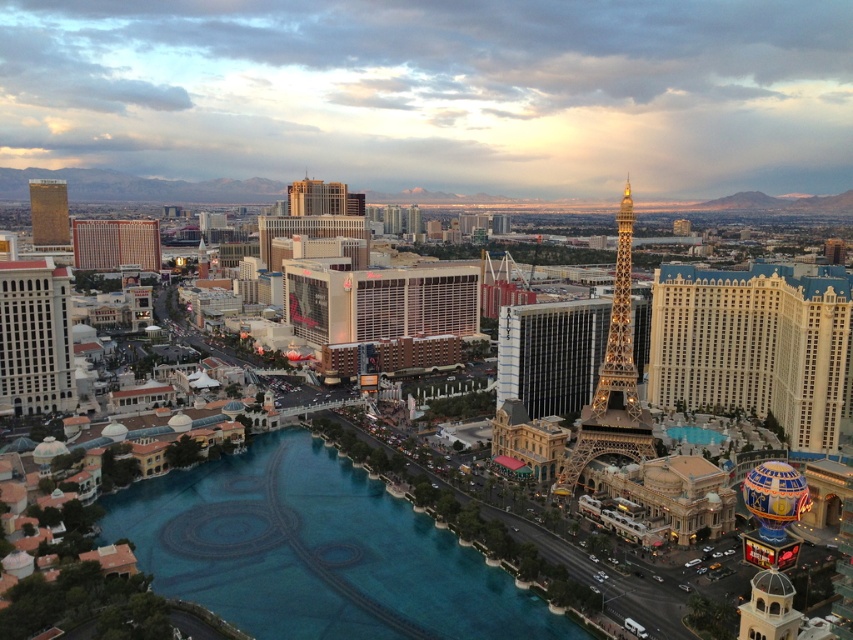
Which is more to the left, gold metallic eiffel tower at center-right or shiny gold metal eiffel tower at center right?

shiny gold metal eiffel tower at center right is more to the left.

Is point (706, 376) positioned after point (619, 365)?

Yes, point (706, 376) is behind point (619, 365).

Identify the location of gold metallic eiffel tower at center-right. (755, 346).

Which of these two, shiny gold metal eiffel tower at center right or gold metallic hotel at center-left, stands shorter?

With less height is gold metallic hotel at center-left.

Is shiny gold metal eiffel tower at center right taller than gold metallic hotel at center-left?

Correct, shiny gold metal eiffel tower at center right is much taller as gold metallic hotel at center-left.

The height and width of the screenshot is (640, 853). I want to click on shiny gold metal eiffel tower at center right, so click(x=613, y=380).

Is gold metallic eiffel tower at center-right smaller than gold reflective tower at upper left?

Indeed, gold metallic eiffel tower at center-right has a smaller size compared to gold reflective tower at upper left.

Does gold metallic eiffel tower at center-right appear over gold reflective tower at upper left?

No.

This screenshot has width=853, height=640. I want to click on gold metallic eiffel tower at center-right, so click(755, 346).

I want to click on gold metallic eiffel tower at center-right, so click(x=755, y=346).